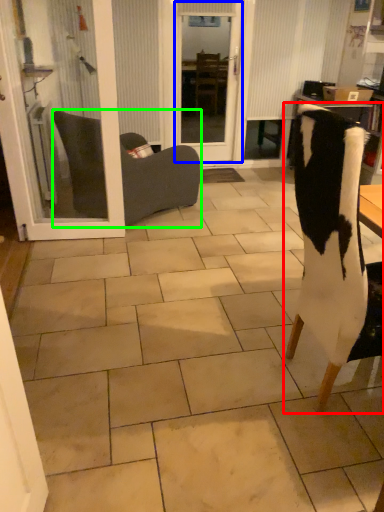
Question: Based on their relative distances, which object is nearer to chair (highlighted by a red box)? Choose from screen door (highlighted by a blue box) and chair (highlighted by a green box).

Choices:
 (A) screen door
 (B) chair

Answer: (B)